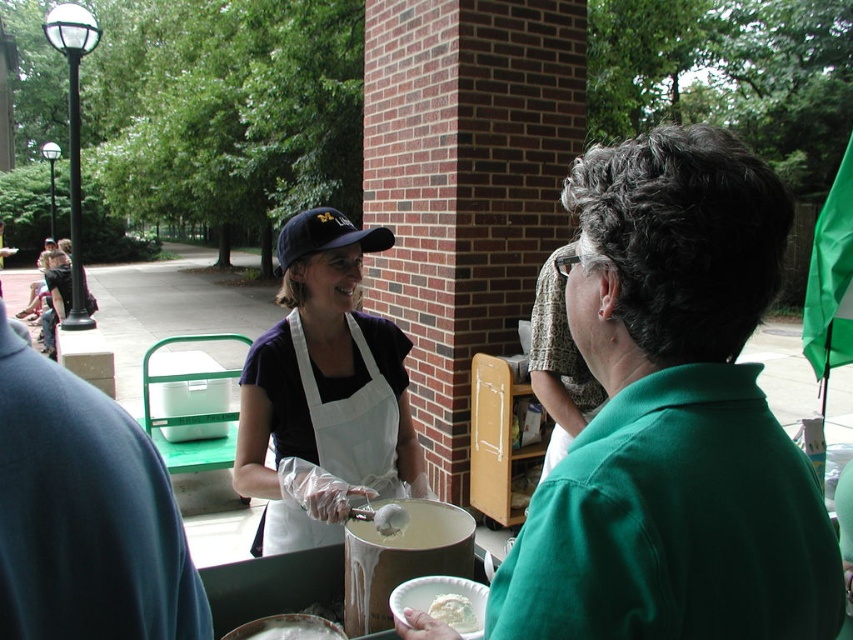
Question: Does blue fabric shirt at left appear over white fabric apron at center?

Choices:
 (A) no
 (B) yes

Answer: (B)

Question: Which point appears closest to the camera in this image?

Choices:
 (A) (328, 234)
 (B) (451, 621)

Answer: (B)

Question: Does dark blue fabric baseball cap at center appear on the left side of white matte paper plate at center?

Choices:
 (A) yes
 (B) no

Answer: (A)

Question: Can you confirm if blue fabric shirt at left is positioned below white fabric apron at center?

Choices:
 (A) no
 (B) yes

Answer: (A)

Question: Which is farther from the blue fabric shirt at left?

Choices:
 (A) white creamy food at lower center
 (B) white fabric apron at center
 (C) dark blue fabric baseball cap at center
 (D) white matte paper plate at center

Answer: (C)

Question: Estimate the real-world distances between objects in this image. Which object is farther from the blue fabric shirt at left?

Choices:
 (A) white creamy food at lower center
 (B) white matte paper plate at center
 (C) dark blue fabric baseball cap at center
 (D) white fabric apron at center

Answer: (C)